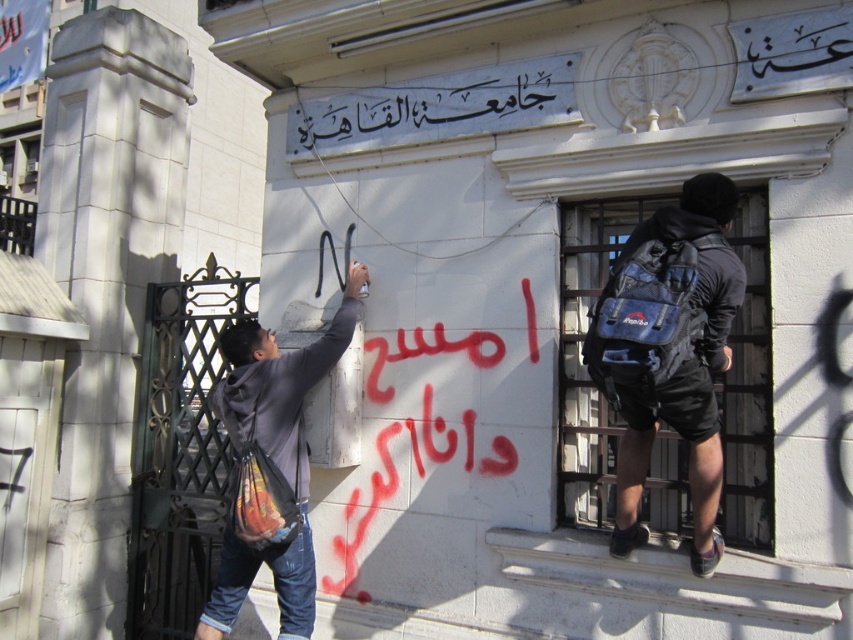
Consider the image. You are a security guard observing the scene. You need to check the distance between the dark blue backpack at right and the dark gray hoodie at left to determine if they are within the restricted area. Which object is nearer to you?

The dark blue backpack at right is closer to the viewer than the dark gray hoodie at left, so the backpack is nearer to you.

You are a security guard who needs to check the distance between the dark blue backpack at right and the dark gray hoodie at left. According to the scene, can you safely walk between them without any obstacles?

The dark blue backpack at right is 1.96 meters away from the dark gray hoodie at left. Since the distance is sufficient, you can safely walk between them without any obstacles.

You are a security guard patrolling the area and notice two items near the building wall. You have to retrieve the dark blue backpack at right first before the dark gray hoodie at left. Which item should you approach first if you are standing in front of the building?

The dark blue backpack at right is to the right of the dark gray hoodie at left, so you should approach the dark blue backpack at right first since it is closer to your right side when facing the building.